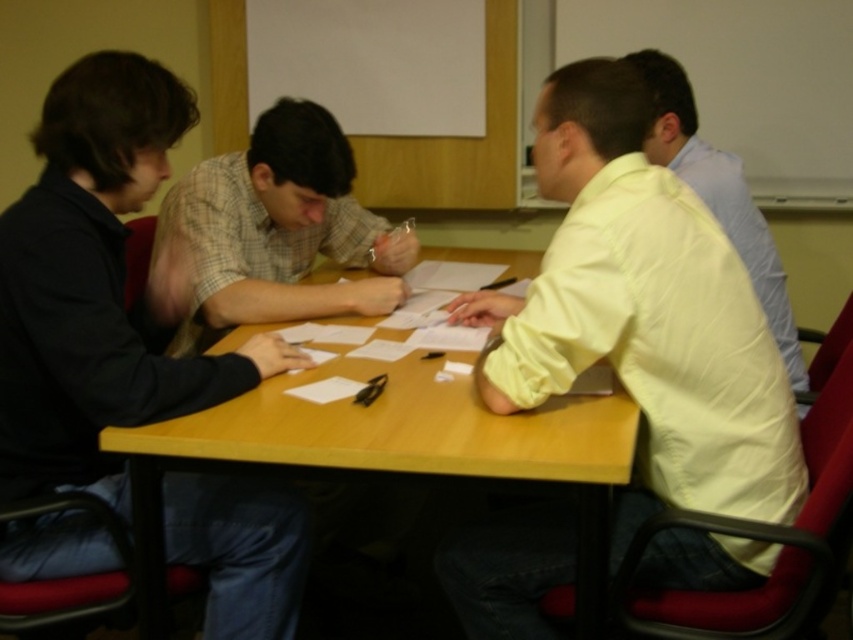
You are a photographer trying to capture a group photo of the black matte shirt at left and the yellow satin shirt at right. Based on their positions, which person should you focus on first to ensure they are in the frame?

The black matte shirt at left is below the yellow satin shirt at right, so you should focus on the yellow satin shirt at right first to ensure both are in the frame.

You are organizing a group photo and need to arrange the black matte shirt at left and yellow satin shirt at right in a row. Since you want the larger one first, which order should they be placed?

The black matte shirt at left is bigger than the yellow satin shirt at right, so they should be arranged with the black matte shirt at left first followed by the yellow satin shirt at right.

You are a photographer standing behind the wooden table at center and want to take a photo of the yellow satin shirt at right. Since the table is in the way, can you lower your camera to capture the shirt without obstruction?

The wooden table at center is not as tall as yellow satin shirt at right, so lowering the camera might still allow capturing the shirt as the table is shorter than the shirt.